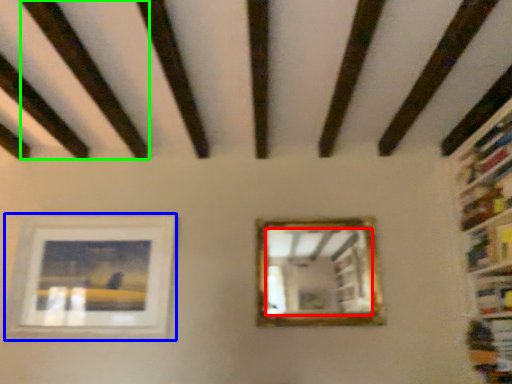
Question: Based on their relative distances, which object is farther from mirror (highlighted by a red box)? Choose from picture frame (highlighted by a blue box) and plank (highlighted by a green box).

Choices:
 (A) picture frame
 (B) plank

Answer: (B)